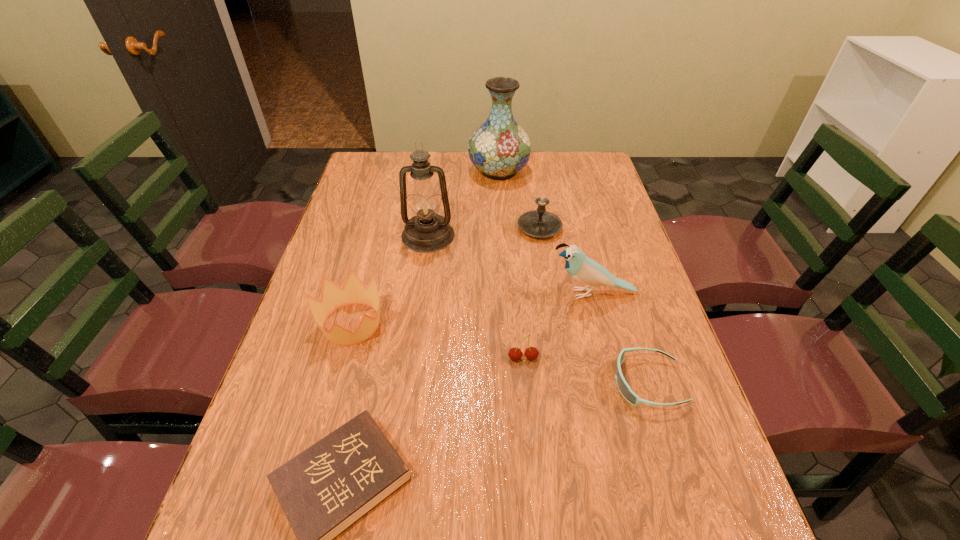
The width and height of the screenshot is (960, 540). What are the coordinates of `vacant region between the fifth shortest object and the oil lamp` in the screenshot? It's located at (484, 232).

The width and height of the screenshot is (960, 540). I want to click on vacant area that lies between the third tallest object and the goggles, so 620,339.

You are a GUI agent. You are given a task and a screenshot of the screen. Output one action in this format:
    pyautogui.click(x=<x>, y=<y>)
    Task: Click on the vacant space that is in between the third tallest object and the goggles
    The height and width of the screenshot is (540, 960).
    Given the screenshot: What is the action you would take?
    pyautogui.click(x=620, y=339)

This screenshot has height=540, width=960. In order to click on the second closest object relative to the oil lamp in this screenshot , I will do `click(499, 148)`.

Identify which object is the fourth nearest to the vase. Please provide its 2D coordinates. Your answer should be formatted as a tuple, i.e. [(x, y)], where the tuple contains the x and y coordinates of a point satisfying the conditions above.

[(333, 297)]

The width and height of the screenshot is (960, 540). What are the coordinates of `free point that satisfies the following two spatial constraints: 1. on the back side of the vase; 2. on the right side of the oil lamp` in the screenshot? It's located at [x=437, y=171].